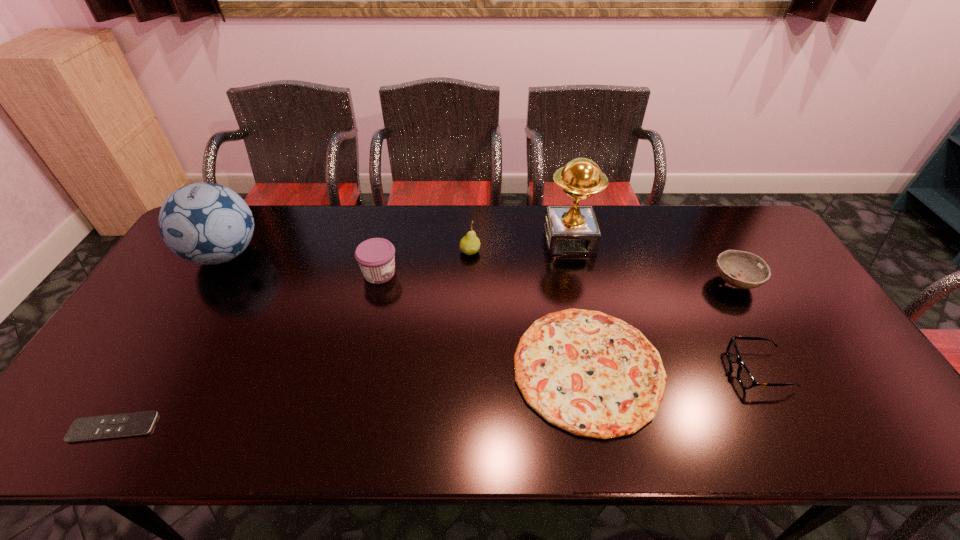
The width and height of the screenshot is (960, 540). Identify the location of soccer ball that is at the far edge. (205, 223).

Identify the location of pear situated at the far edge. This screenshot has width=960, height=540. (470, 244).

Locate an element on the screen. The width and height of the screenshot is (960, 540). pizza that is at the near edge is located at coordinates (591, 374).

Find the location of a particular element. This screenshot has height=540, width=960. remote control that is at the near edge is located at coordinates (138, 423).

Locate an element on the screen. The width and height of the screenshot is (960, 540). soccer ball present at the left edge is located at coordinates 205,223.

At what (x,y) coordinates should I click in order to perform the action: click on remote control that is at the left edge. Please return your answer as a coordinate pair (x, y). This screenshot has width=960, height=540. Looking at the image, I should click on (138, 423).

Where is `object located at the right edge`? Image resolution: width=960 pixels, height=540 pixels. object located at the right edge is located at coordinates (750, 271).

I want to click on object situated at the far left corner, so click(x=205, y=223).

This screenshot has width=960, height=540. I want to click on object situated at the near left corner, so click(x=138, y=423).

In order to click on vacant space at the far edge of the desktop in this screenshot , I will do `click(396, 211)`.